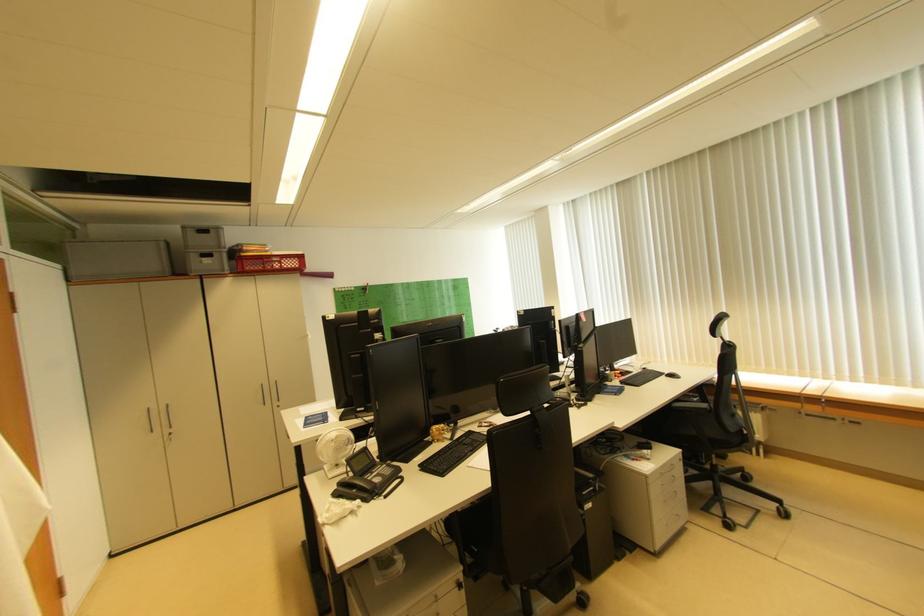
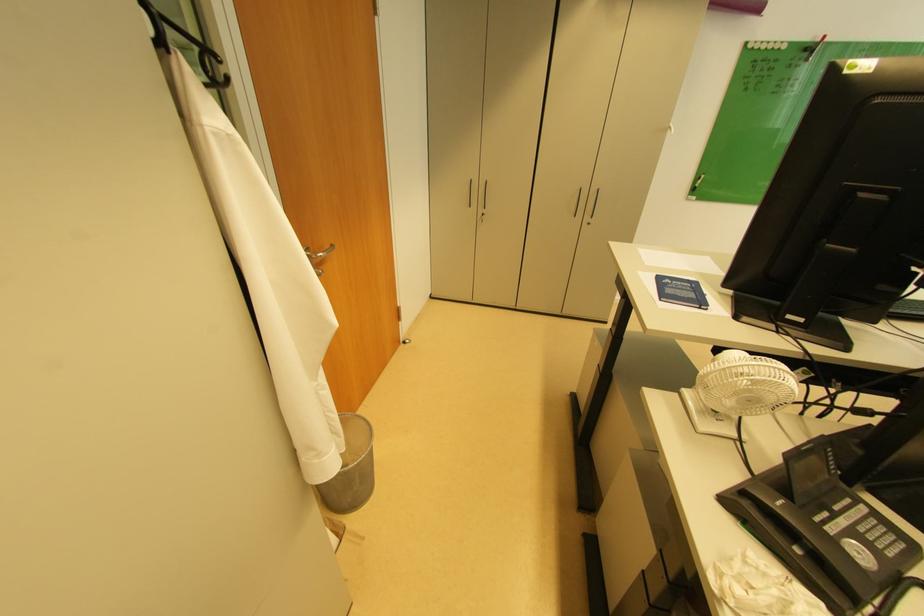
The point at (339, 477) is marked in the first image. Where is the corresponding point in the second image?

(711, 430)